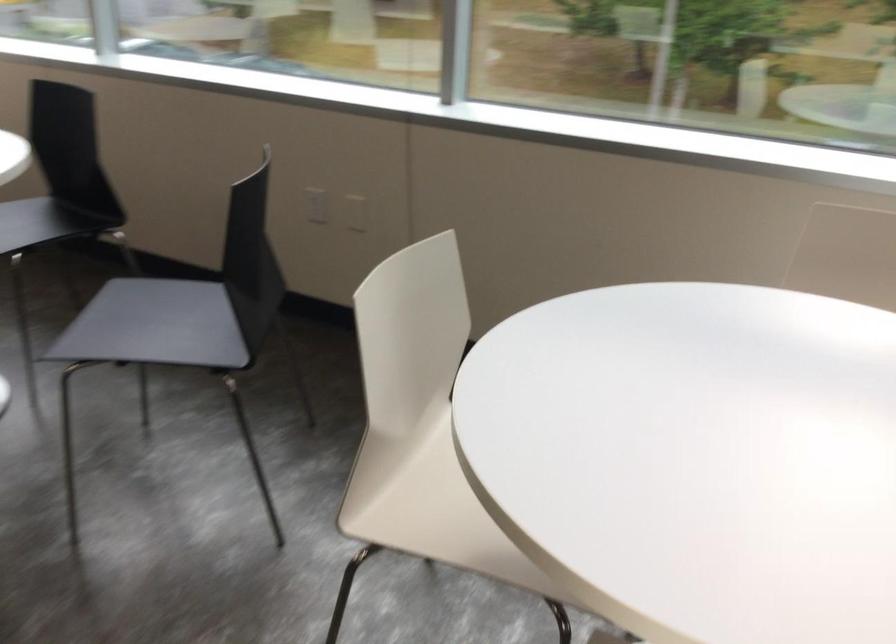
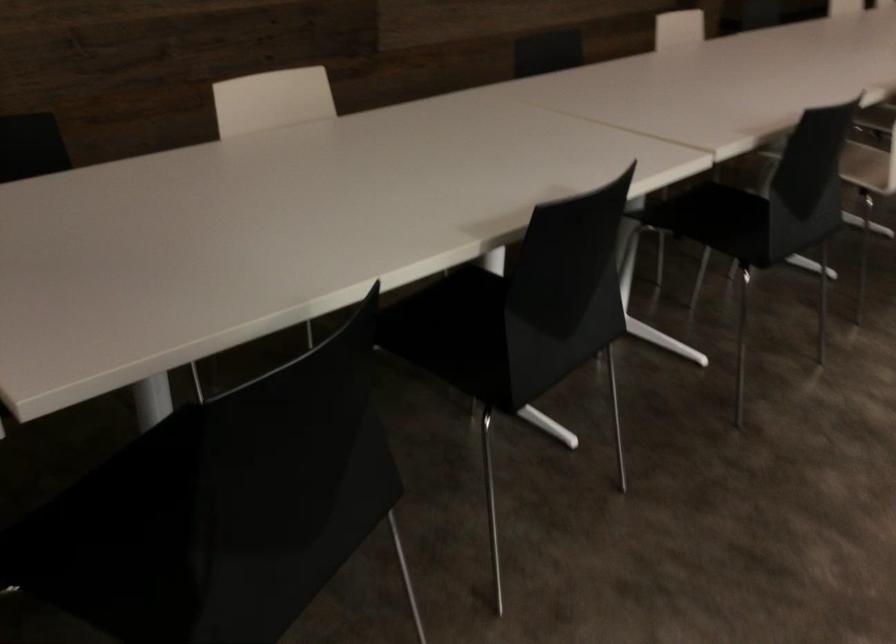
Based on the photo, how did the camera likely rotate?

The rotation direction of the camera is left-down.